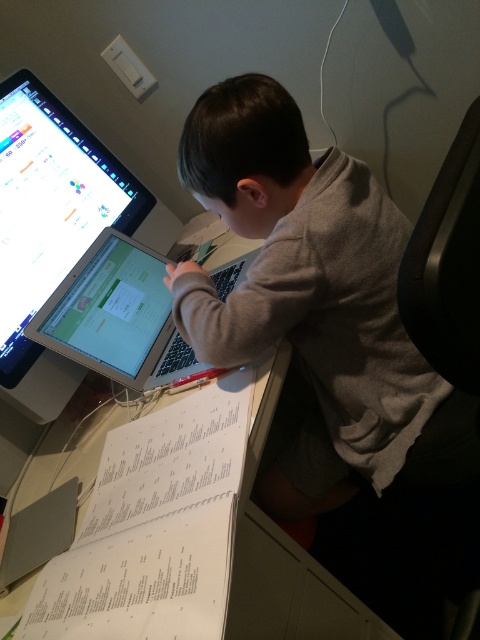
Question: In this image, where is white paper at lower left located relative to matte black monitor at upper left?

Choices:
 (A) right
 (B) left

Answer: (A)

Question: Which of these objects is positioned farthest from the silver metallic laptop at center?

Choices:
 (A) white paper at lower left
 (B) gray matte shirt at upper center
 (C) matte black monitor at upper left

Answer: (A)

Question: Is matte black monitor at upper left positioned before silver metallic laptop at center?

Choices:
 (A) yes
 (B) no

Answer: (A)

Question: Can you confirm if matte black monitor at upper left is positioned to the right of silver metallic laptop at center?

Choices:
 (A) no
 (B) yes

Answer: (A)

Question: Which point is farther from the camera taking this photo?

Choices:
 (A) (92, 342)
 (B) (224, 620)
 (C) (8, 257)
 (D) (415, 385)

Answer: (A)

Question: Which point is farther from the camera taking this photo?

Choices:
 (A) (66, 120)
 (B) (165, 545)
 (C) (216, 307)

Answer: (A)